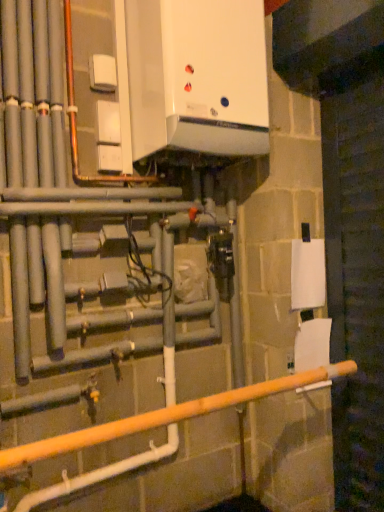
Question: In the image, is white glossy boiler at upper center positioned in front of or behind white matte toilet paper at right, which appears as the first toilet paper when viewed from the top?

Choices:
 (A) front
 (B) behind

Answer: (A)

Question: In terms of size, does white glossy boiler at upper center appear bigger or smaller than white matte toilet paper at right, which is the second toilet paper from bottom to top?

Choices:
 (A) big
 (B) small

Answer: (A)

Question: Considering the real-world distances, which object is farthest from the white matte toilet paper at lower right, which is counted as the 2th toilet paper, starting from the top?

Choices:
 (A) white glossy boiler at upper center
 (B) white matte toilet paper at right, which is the second toilet paper from bottom to top
 (C) wooden pole at lower center

Answer: (A)

Question: Estimate the real-world distances between objects in this image. Which object is closer to the white matte toilet paper at right, which appears as the first toilet paper when viewed from the top?

Choices:
 (A) wooden pole at lower center
 (B) white glossy boiler at upper center
 (C) white matte toilet paper at lower right, which is counted as the 2th toilet paper, starting from the top

Answer: (C)